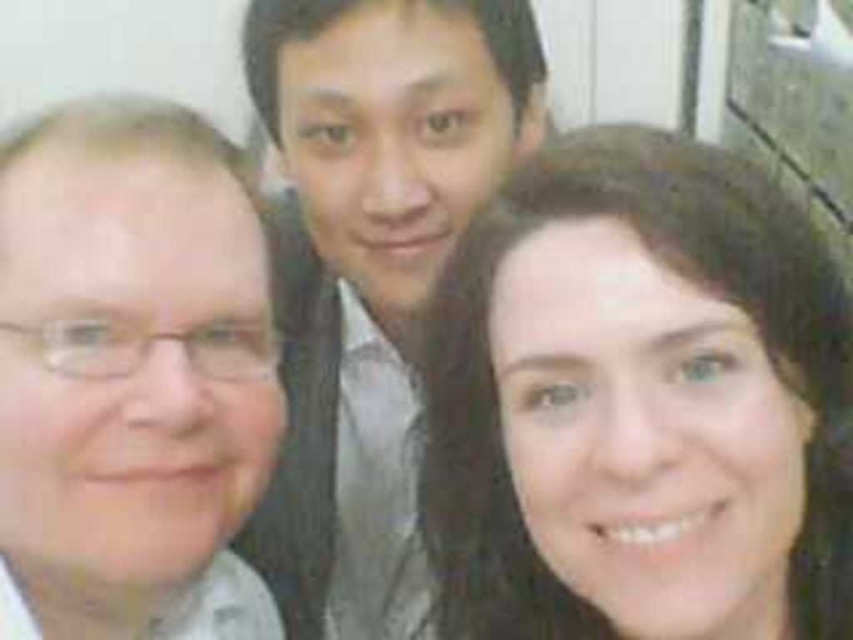
Based on the scene description, which object is shorter between the smooth brown hair at center and the matte gray shirt at center?

The smooth brown hair at center is shorter than the matte gray shirt at center.

You are holding a 24 inch wide painting and want to hang it on the wall in the scene. The point at coordinates point (840, 344) is where you want the center of the painting to be. Will the painting fit without overlapping any visible objects in the scene?

The point point (840, 344) and viewer are 26.51 inches apart. Since the painting is 24 inches wide, it will fit as the distance from the viewer to the point is greater than the painting width, so there will be no overlap with visible objects.

You are a photographer trying to adjust the lighting for a group photo. You notice the smooth brown hair at center and the matte gray shirt at center. Which object is closer to the camera?

The smooth brown hair at center is in front of the matte gray shirt at center, so it is closer to the camera.